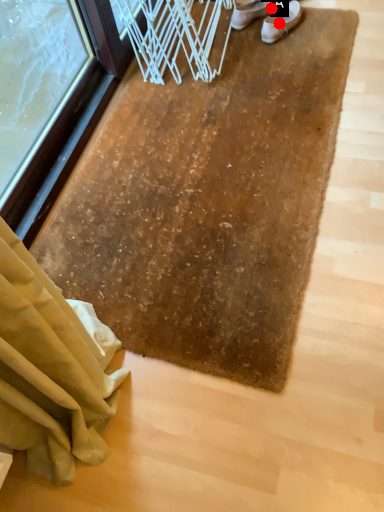
Question: Two points are circled on the image, labeled by A and B beside each circle. Which point is further to the camera?

Choices:
 (A) A is further
 (B) B is further

Answer: (B)